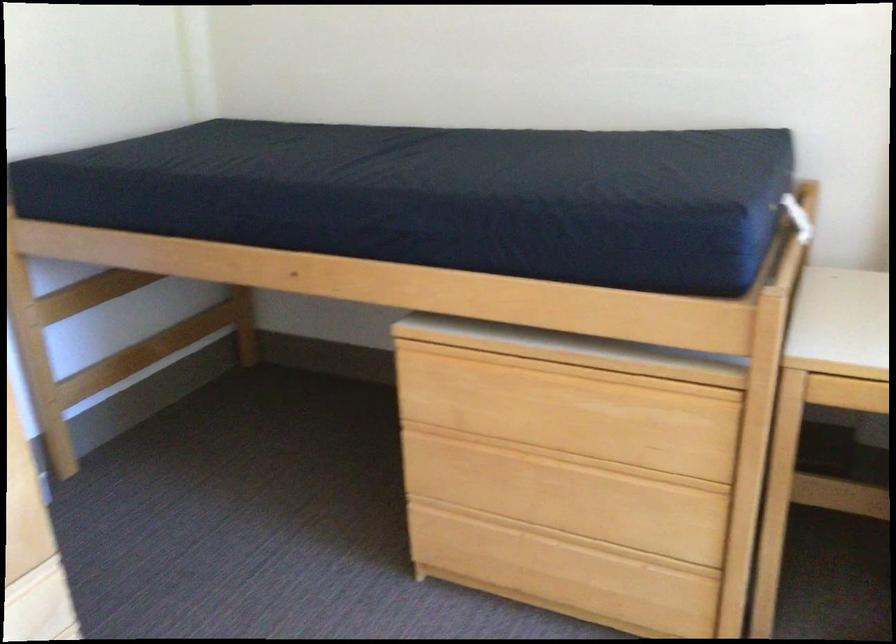
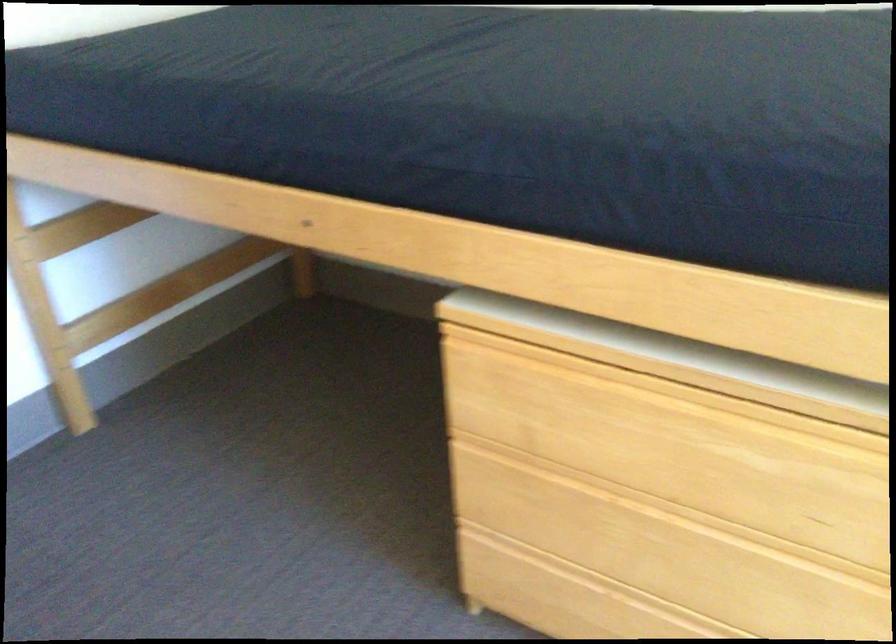
Question: Which direction would the cameraman need to move to produce the second image? Reply with the corresponding letter.

Choices:
 (A) Left
 (B) Right
 (C) Forward
 (D) Backward

Answer: (C)